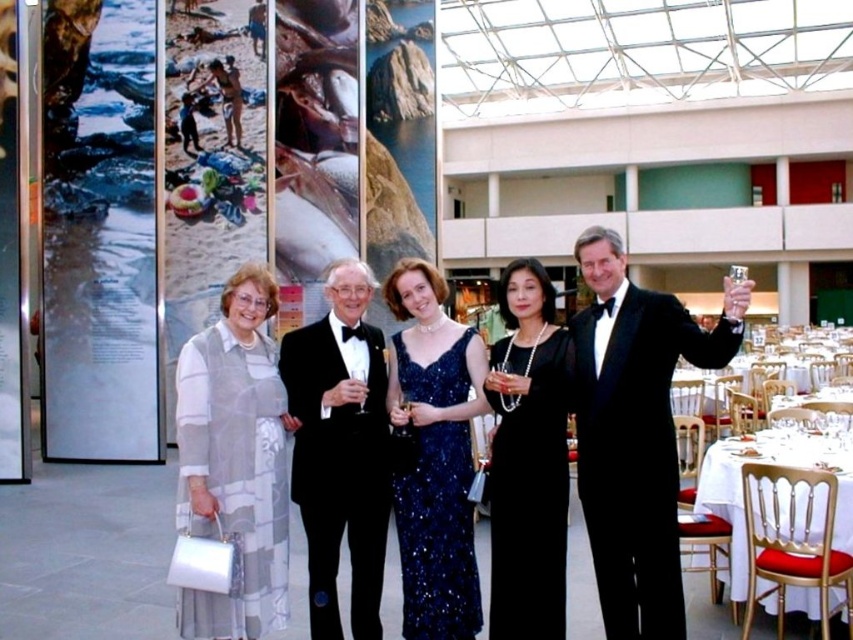
Does black satin dress at center have a lesser width compared to navy sequined dress at center?

Indeed, black satin dress at center has a lesser width compared to navy sequined dress at center.

Can you confirm if black satin dress at center is shorter than navy sequined dress at center?

Yes.

Between point (514, 516) and point (416, 374), which one is positioned in front?

Positioned in front is point (514, 516).

Identify the location of black satin dress at center. (529, 492).

Which is above, black satin tuxedo at center or white cloth at lower right?

black satin tuxedo at center

Does black satin tuxedo at center appear on the left side of white cloth at lower right?

Yes, black satin tuxedo at center is to the left of white cloth at lower right.

Does point (379, 541) come farther from viewer compared to point (738, 497)?

Yes.

Identify the location of black satin tuxedo at center. (340, 449).

Which is in front, point (634, 595) or point (459, 467)?

Point (634, 595) is in front.

Does black velvet tuxedo at right appear over navy sequined dress at center?

Correct, black velvet tuxedo at right is located above navy sequined dress at center.

Who is more distant from viewer, (599, 301) or (425, 426)?

Positioned behind is point (425, 426).

The image size is (853, 640). I want to click on black velvet tuxedo at right, so (x=635, y=432).